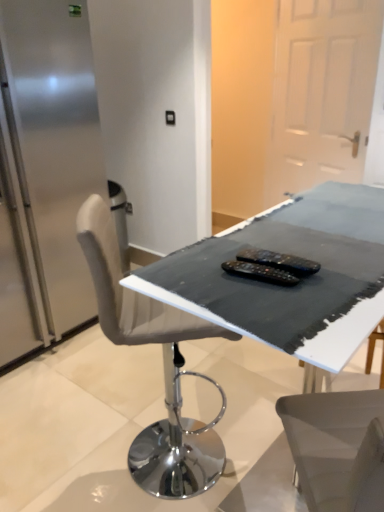
This screenshot has height=512, width=384. Identify the location of free space to the left of black plastic remote controls at center, arranged as the 2th equipment when viewed from the top. (193, 278).